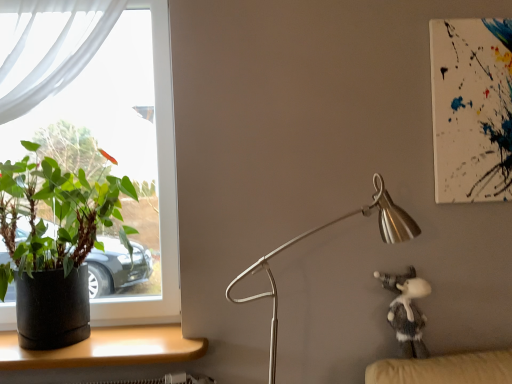
Question: From a real-world perspective, relative to black matte pot at left, is clear glass window at left vertically above or below?

Choices:
 (A) below
 (B) above

Answer: (B)

Question: Would you say clear glass window at left is inside or outside black matte pot at left?

Choices:
 (A) inside
 (B) outside

Answer: (B)

Question: Which is nearer to the wooden desk at lower left?

Choices:
 (A) fuzzy gray plush at lower right
 (B) black matte pot at left
 (C) silver metallic lamp at center-right
 (D) clear glass window at left

Answer: (B)

Question: Which is farther from the silver metallic lamp at center-right?

Choices:
 (A) fuzzy gray plush at lower right
 (B) black matte pot at left
 (C) wooden desk at lower left
 (D) clear glass window at left

Answer: (D)